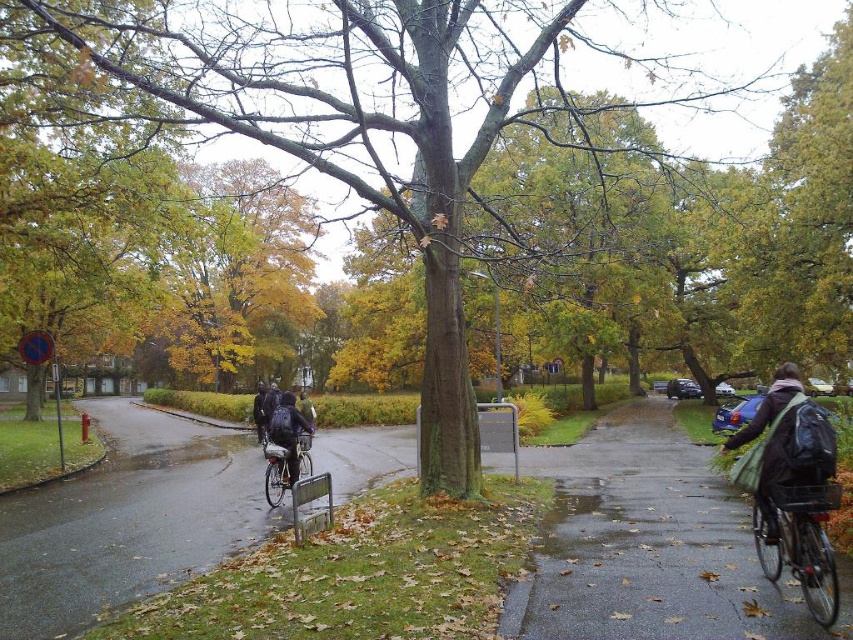
Question: Does green backpack at right have a lesser width compared to metallic silver bicycle at lower right?

Choices:
 (A) no
 (B) yes

Answer: (A)

Question: Does dark gray asphalt at lower left appear on the right side of dark blue backpack at center?

Choices:
 (A) no
 (B) yes

Answer: (A)

Question: Which is farther from the dark blue backpack at center?

Choices:
 (A) silver metallic bicycle at center
 (B) green backpack at right
 (C) metallic silver bicycle at lower right
 (D) dark gray asphalt at lower left

Answer: (B)

Question: Can you confirm if dark blue backpack at center is wider than silver metallic bicycle at center?

Choices:
 (A) yes
 (B) no

Answer: (A)

Question: Which of these objects is positioned farthest from the dark gray asphalt at lower left?

Choices:
 (A) metallic silver bicycle at lower right
 (B) dark blue backpack at center
 (C) silver metallic bicycle at center

Answer: (A)

Question: Which of these objects is positioned farthest from the metallic silver bicycle at lower right?

Choices:
 (A) dark gray asphalt at lower left
 (B) dark blue backpack at center

Answer: (A)